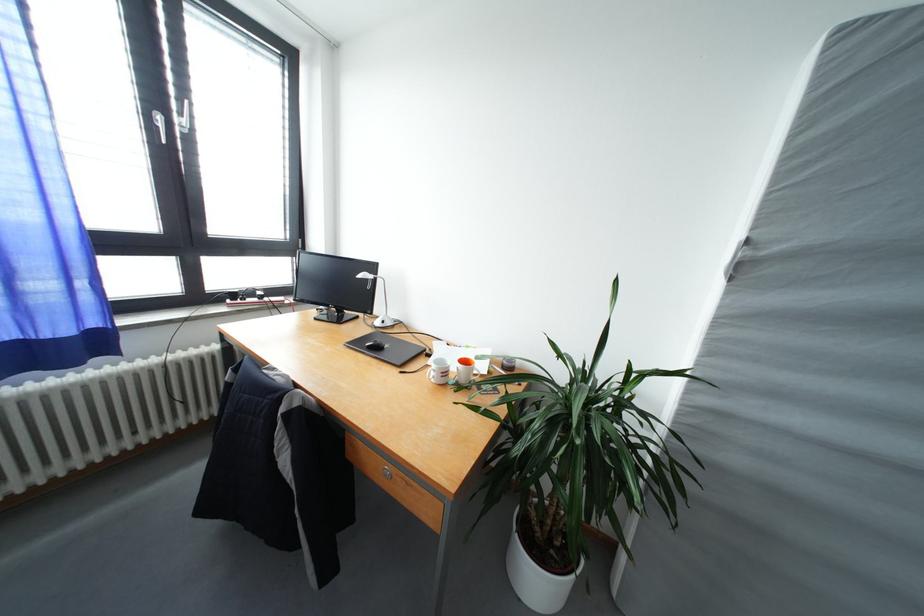
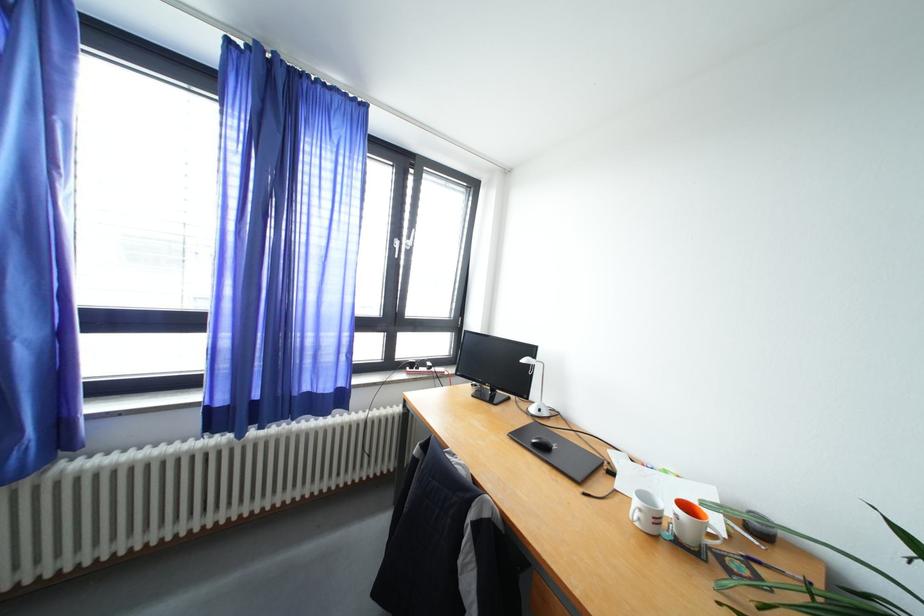
Find the pixel in the second image that matches [383,328] in the first image.

(540, 415)